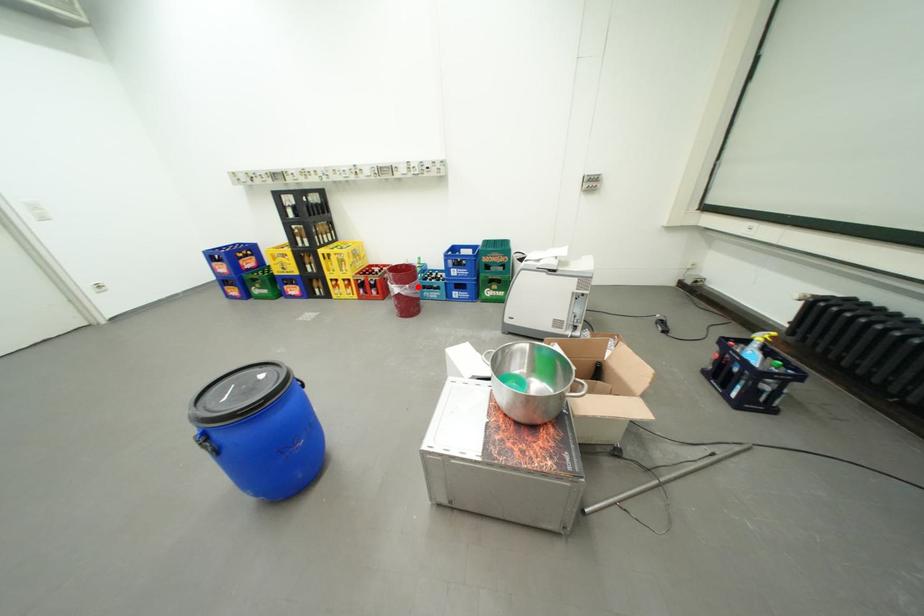
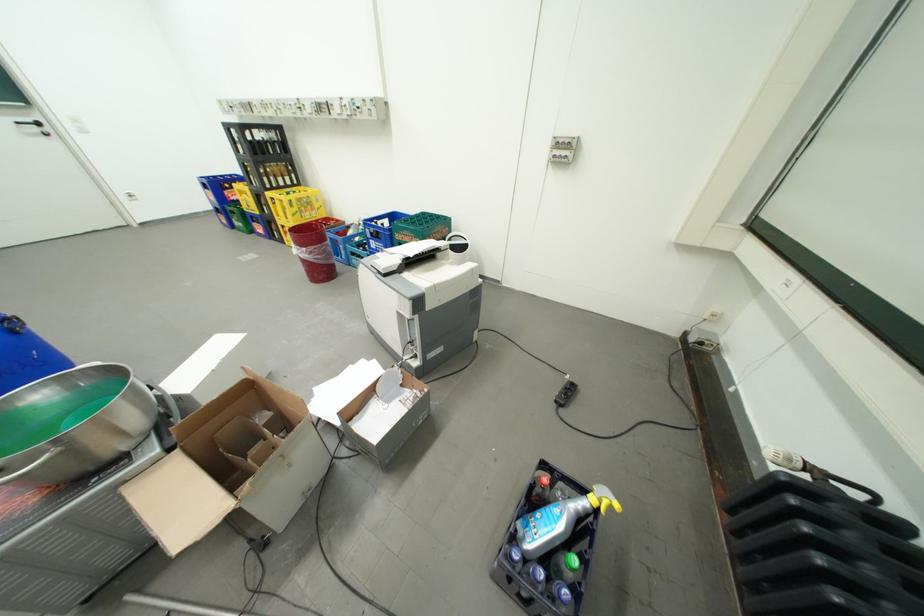
Question: I am providing you with two images of the same scene from different viewpoints. Given a red point in image1, look at the same physical point in image2. Is it:

Choices:
 (A) Closer to the viewpoint
 (B) Farther from the viewpoint

Answer: (A)